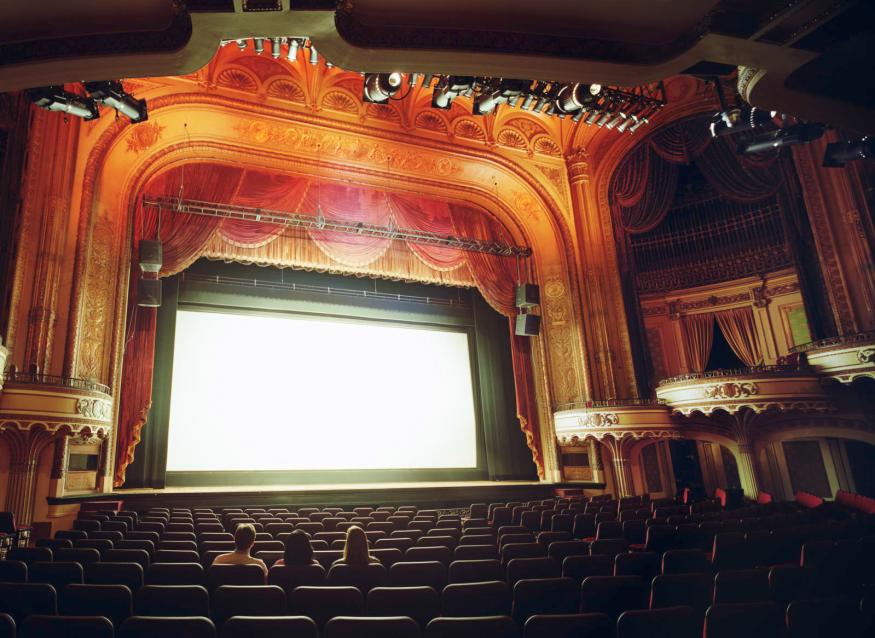
Identify the location of brown ceiling. (528, 34).